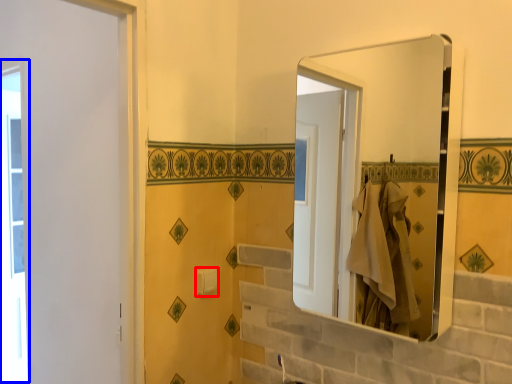
Question: Which point is closer to the camera, towel bar (highlighted by a red box) or window (highlighted by a blue box)?

Choices:
 (A) towel bar
 (B) window

Answer: (A)